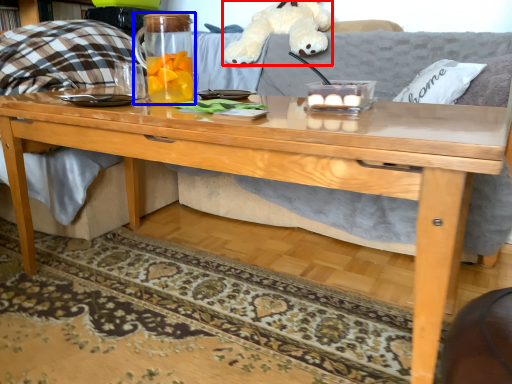
Question: Which point is further to the camera, toy (highlighted by a red box) or beverage (highlighted by a blue box)?

Choices:
 (A) toy
 (B) beverage

Answer: (A)